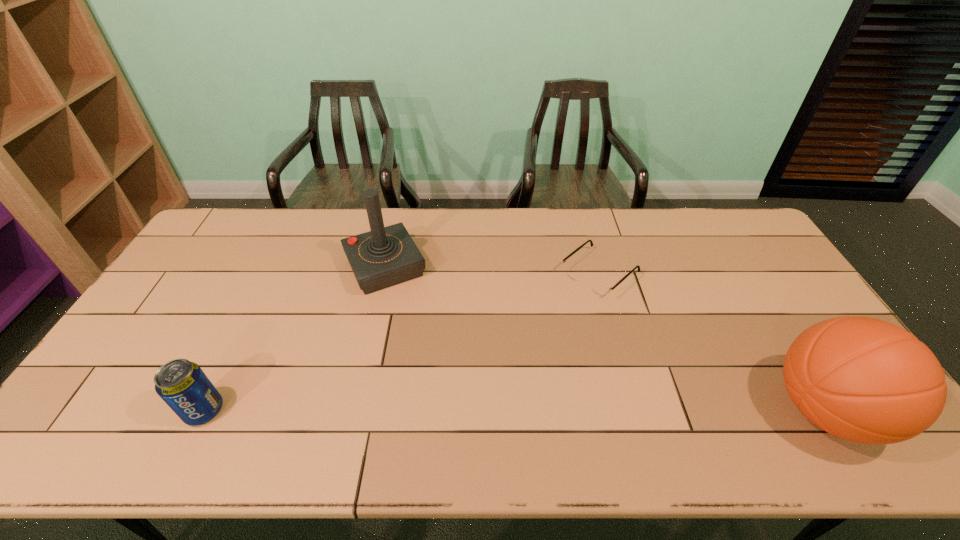
The height and width of the screenshot is (540, 960). Identify the location of vacant space located 0.350m on the rectangular base of the second object from left to right. (444, 383).

Find the location of a particular element. vacant space located at the hinge ends of the spectacles is located at coordinates (485, 372).

This screenshot has width=960, height=540. In order to click on vacant space located at the hinge ends of the spectacles in this screenshot , I will do `click(527, 336)`.

Locate an element on the screen. vacant point located 0.390m at the hinge ends of the spectacles is located at coordinates (488, 370).

Locate an element on the screen. The height and width of the screenshot is (540, 960). joystick that is at the far edge is located at coordinates (385, 256).

Locate an element on the screen. The image size is (960, 540). spectacles that is at the far edge is located at coordinates (597, 287).

Locate an element on the screen. soda situated at the near edge is located at coordinates (184, 387).

Locate an element on the screen. Image resolution: width=960 pixels, height=540 pixels. basketball positioned at the near edge is located at coordinates (865, 380).

I want to click on object at the right edge, so click(x=865, y=380).

The image size is (960, 540). I want to click on object at the near right corner, so click(865, 380).